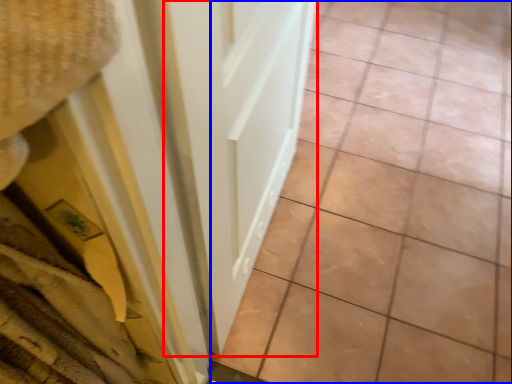
Question: Among these objects, which one is nearest to the camera, door (highlighted by a red box) or ceramic tile (highlighted by a blue box)?

Choices:
 (A) door
 (B) ceramic tile

Answer: (A)